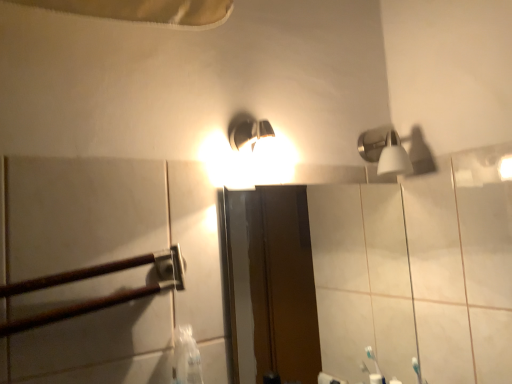
Question: Is brown wooden rail at left in front of satin nickel shower head at upper right?

Choices:
 (A) no
 (B) yes

Answer: (B)

Question: Does brown wooden rail at left turn towards satin nickel shower head at upper right?

Choices:
 (A) yes
 (B) no

Answer: (B)

Question: Considering the relative sizes of brown wooden rail at left and satin nickel shower head at upper right in the image provided, is brown wooden rail at left thinner than satin nickel shower head at upper right?

Choices:
 (A) yes
 (B) no

Answer: (A)

Question: From the image's perspective, is brown wooden rail at left beneath satin nickel shower head at upper right?

Choices:
 (A) yes
 (B) no

Answer: (A)

Question: Does brown wooden rail at left have a greater height compared to satin nickel shower head at upper right?

Choices:
 (A) no
 (B) yes

Answer: (B)

Question: From the image's perspective, is brown wooden rail at left above or below satin nickel shower head at upper right?

Choices:
 (A) below
 (B) above

Answer: (A)

Question: Based on their sizes in the image, would you say brown wooden rail at left is bigger or smaller than satin nickel shower head at upper right?

Choices:
 (A) small
 (B) big

Answer: (A)

Question: Considering the positions of point pos(69,309) and point pos(387,172), is point pos(69,309) closer or farther from the camera than point pos(387,172)?

Choices:
 (A) closer
 (B) farther

Answer: (A)

Question: Relative to satin nickel shower head at upper right, is brown wooden rail at left in front or behind?

Choices:
 (A) behind
 (B) front

Answer: (B)

Question: Looking at their shapes, would you say brown wooden rail at left is wider or thinner than matte glass mirror at center?

Choices:
 (A) wide
 (B) thin

Answer: (A)

Question: From a real-world perspective, is brown wooden rail at left above or below matte glass mirror at center?

Choices:
 (A) above
 (B) below

Answer: (A)

Question: Considering the positions of point (x=79, y=314) and point (x=474, y=241), is point (x=79, y=314) closer or farther from the camera than point (x=474, y=241)?

Choices:
 (A) closer
 (B) farther

Answer: (A)

Question: Is brown wooden rail at left bigger or smaller than matte glass mirror at center?

Choices:
 (A) small
 (B) big

Answer: (A)

Question: Is satin nickel shower head at upper right wider or thinner than brown wooden rail at left?

Choices:
 (A) wide
 (B) thin

Answer: (A)

Question: From the image's perspective, is satin nickel shower head at upper right located above or below brown wooden rail at left?

Choices:
 (A) above
 (B) below

Answer: (A)